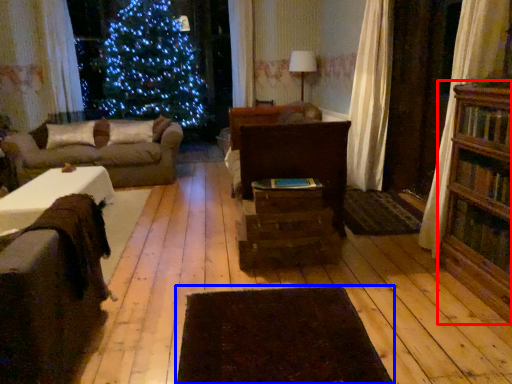
Question: Which object is further to the camera taking this photo, bookcase (highlighted by a red box) or wide (highlighted by a blue box)?

Choices:
 (A) bookcase
 (B) wide

Answer: (A)